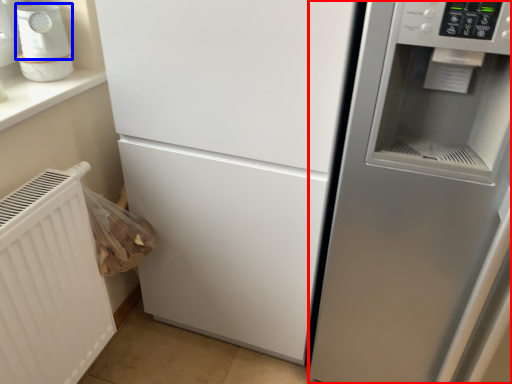
Question: Which object appears closest to the camera in this image, fridge (highlighted by a red box) or appliance (highlighted by a blue box)?

Choices:
 (A) fridge
 (B) appliance

Answer: (A)